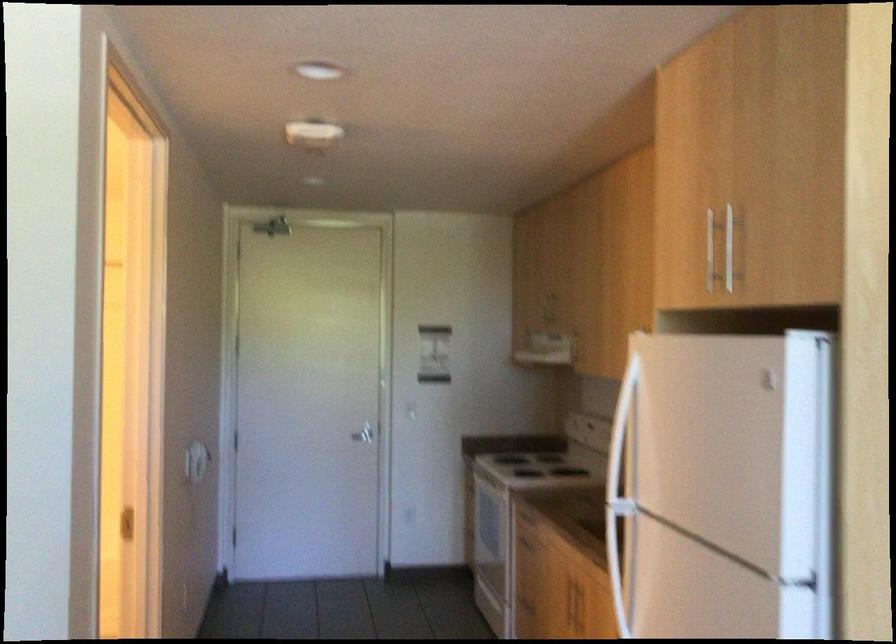
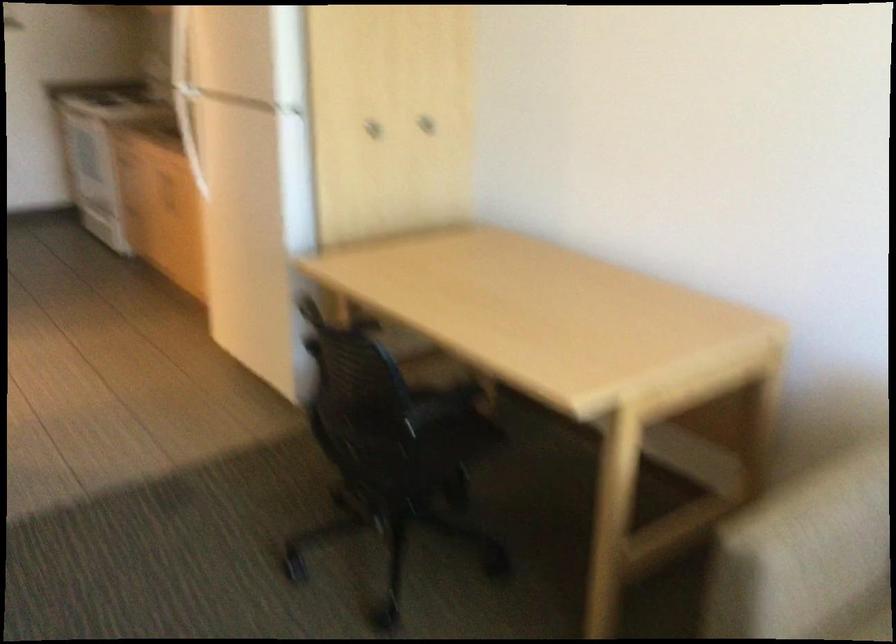
Find the pixel in the second image that matches point 609,482 in the first image.

(185, 93)